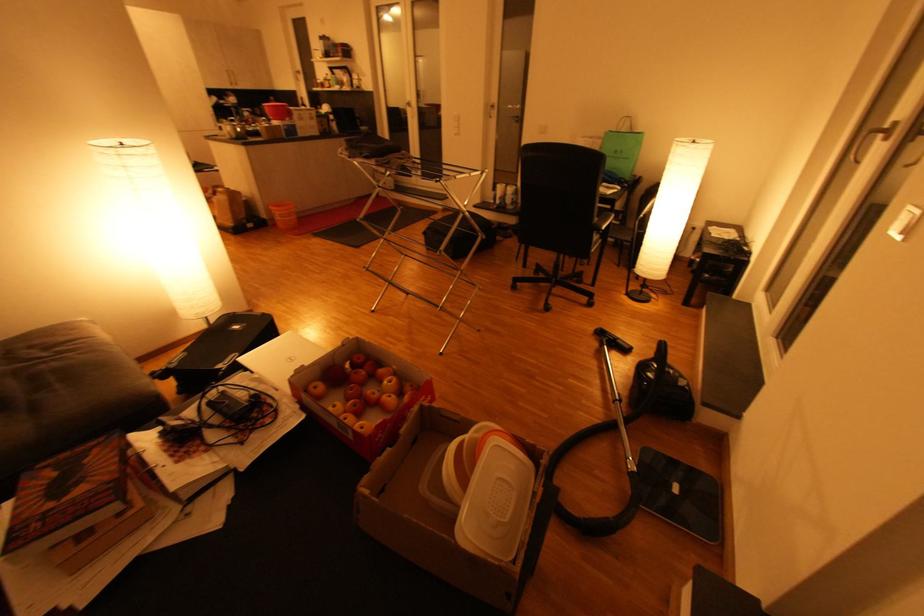
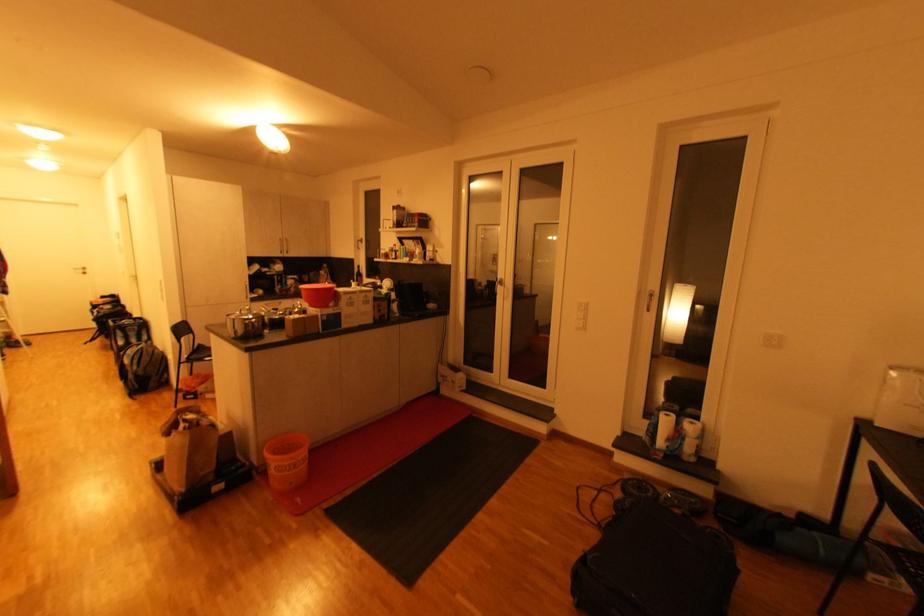
In a continuous first-person perspective shot, in which direction is the camera moving?

The cameraman moved toward left, forward.